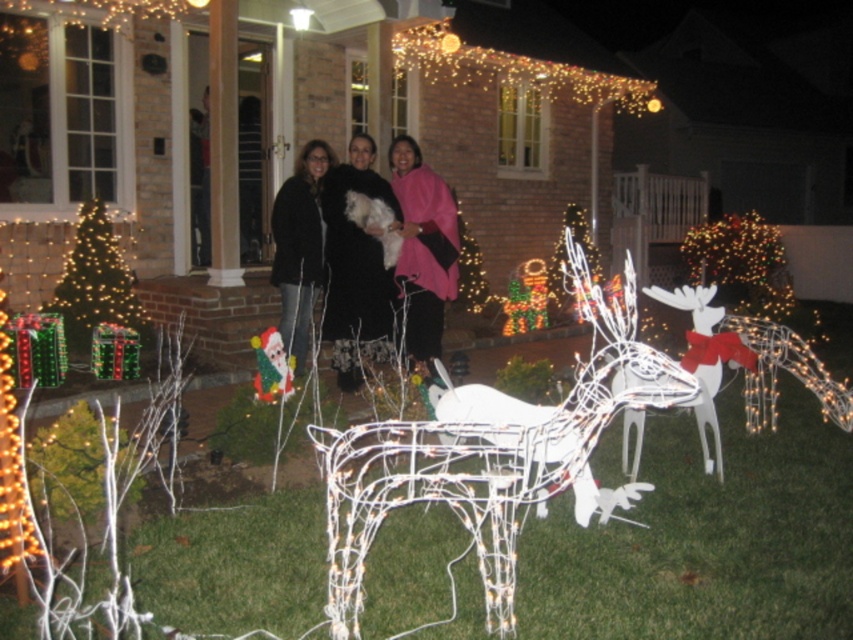
This screenshot has height=640, width=853. What are the coordinates of `black fuzzy coat at center` in the screenshot? It's located at (357, 268).

Between black fuzzy coat at center and black matte jacket at center, which one has less height?

Standing shorter between the two is black matte jacket at center.

Is point (351, 268) farther from viewer compared to point (305, 317)?

No, (351, 268) is closer to viewer.

This screenshot has width=853, height=640. I want to click on black fuzzy coat at center, so click(x=357, y=268).

The height and width of the screenshot is (640, 853). I want to click on black matte jacket at center, so click(x=299, y=248).

Measure the distance between black matte jacket at center and camera.

black matte jacket at center is 6.20 meters away from camera.

At what (x,y) coordinates should I click in order to perform the action: click on black matte jacket at center. Please return your answer as a coordinate pair (x, y). This screenshot has width=853, height=640. Looking at the image, I should click on (299, 248).

Who is more forward, (328,314) or (79,289)?

Positioned in front is point (328,314).

Is point (372, 305) positioned after point (64, 275)?

No, it is not.

Identify the location of black fuzzy coat at center. (357, 268).